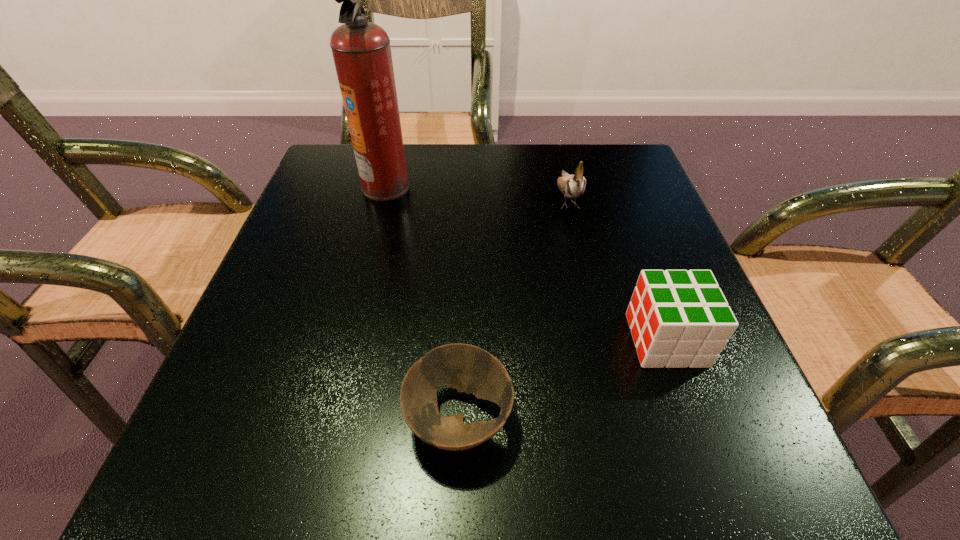
You are a GUI agent. You are given a task and a screenshot of the screen. Output one action in this format:
    pyautogui.click(x=<x>, y=<y>)
    Task: Click on the object positioned at the far left corner
    The height and width of the screenshot is (540, 960).
    Given the screenshot: What is the action you would take?
    pyautogui.click(x=361, y=50)

Locate an element on the screen. The height and width of the screenshot is (540, 960). object situated at the far right corner is located at coordinates (572, 186).

The width and height of the screenshot is (960, 540). I want to click on free location at the far edge of the desktop, so click(420, 174).

Locate an element on the screen. This screenshot has height=540, width=960. vacant space at the near edge of the desktop is located at coordinates (546, 444).

This screenshot has width=960, height=540. Identify the location of vacant space at the left edge of the desktop. (294, 247).

In the image, there is a desktop. Where is `free region at the right edge`? This screenshot has width=960, height=540. free region at the right edge is located at coordinates (715, 375).

The height and width of the screenshot is (540, 960). In order to click on free space at the far left corner in this screenshot , I will do `click(349, 178)`.

In the image, there is a desktop. Identify the location of free region at the near left corner. Image resolution: width=960 pixels, height=540 pixels. (257, 444).

The height and width of the screenshot is (540, 960). In the image, there is a desktop. In order to click on free space at the far right corner in this screenshot , I will do pos(603,155).

You are a GUI agent. You are given a task and a screenshot of the screen. Output one action in this format:
    pyautogui.click(x=<x>, y=<y>)
    Task: Click on the empty location between the leftmost object and the nearest object
    The width and height of the screenshot is (960, 540).
    Given the screenshot: What is the action you would take?
    pyautogui.click(x=422, y=302)